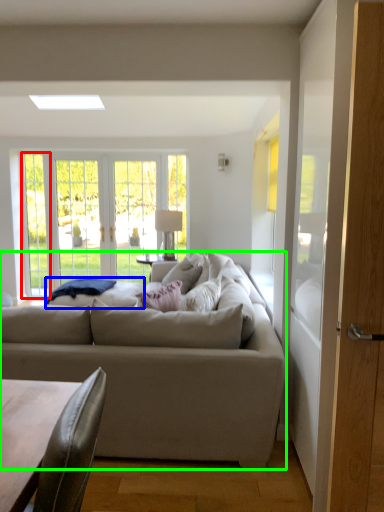
Question: Which object is positioned farthest from window (highlighted by a red box)? Select from wide (highlighted by a blue box) and studio couch (highlighted by a green box).

Choices:
 (A) wide
 (B) studio couch

Answer: (B)